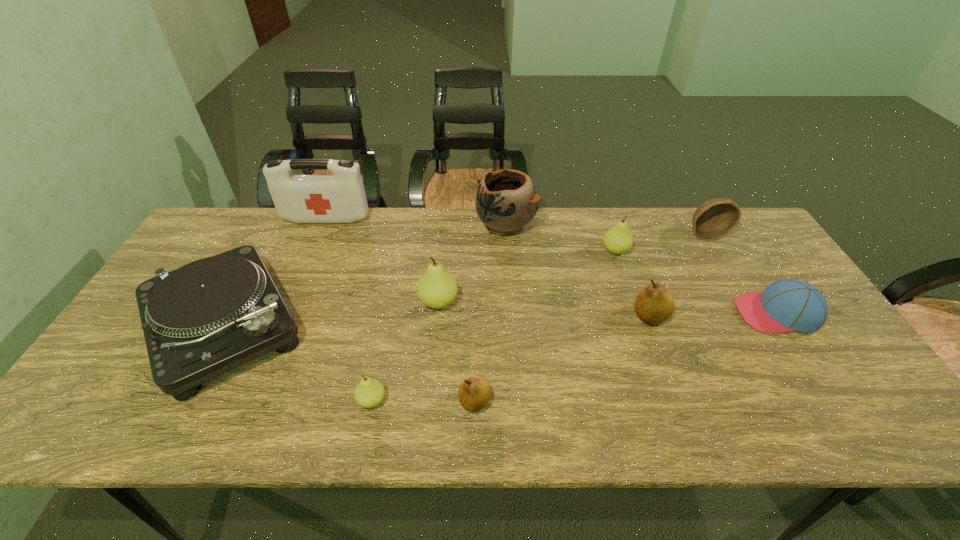
In the image, there is a desktop. In order to click on vacant space at the left edge in this screenshot , I will do `click(113, 359)`.

This screenshot has height=540, width=960. I want to click on free space at the right edge of the desktop, so click(749, 292).

Identify the location of free spot at the far left corner of the desktop. This screenshot has width=960, height=540. (252, 232).

This screenshot has height=540, width=960. I want to click on vacant area at the far right corner of the desktop, so click(x=734, y=235).

At what (x,y) coordinates should I click in order to perform the action: click on free spot between the smaller brown pear and the baseball cap. Please return your answer as a coordinate pair (x, y). Looking at the image, I should click on (626, 357).

Locate an element on the screen. The height and width of the screenshot is (540, 960). vacant area between the second smallest green pear and the nearer brown pear is located at coordinates (545, 326).

Image resolution: width=960 pixels, height=540 pixels. I want to click on vacant point located between the second farthest green pear and the bowl, so click(572, 268).

Locate an element on the screen. The image size is (960, 540). free space between the baseball cap and the farthest pear is located at coordinates (696, 282).

You are a GUI agent. You are given a task and a screenshot of the screen. Output one action in this format:
    pyautogui.click(x=<x>, y=<y>)
    Task: Click on the vacant area between the farther brown pear and the tallest object
    The height and width of the screenshot is (540, 960).
    Given the screenshot: What is the action you would take?
    pyautogui.click(x=488, y=267)

This screenshot has height=540, width=960. I want to click on empty space between the eighth object from right to left and the nearer brown pear, so click(423, 401).